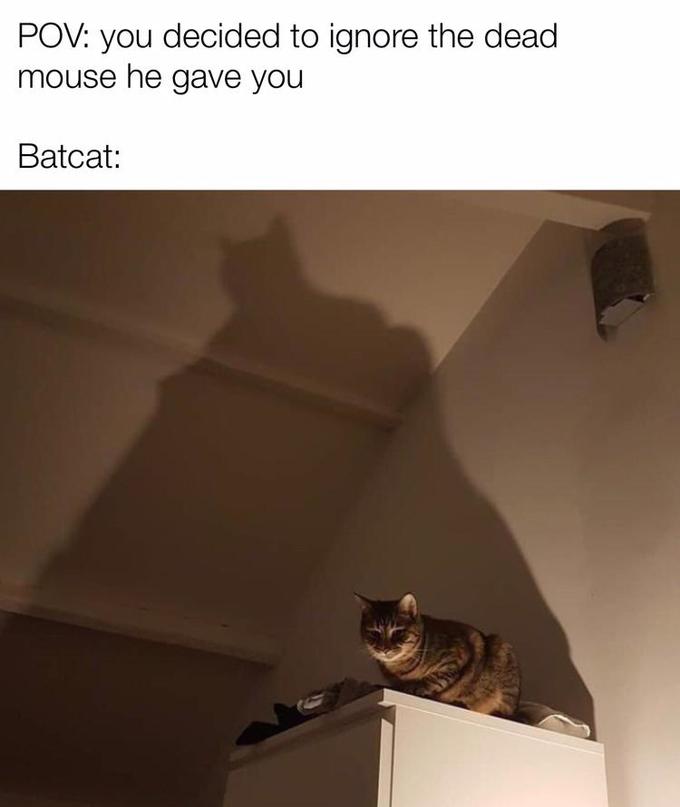
Identify the location of towel. The image size is (680, 807). (551, 721).